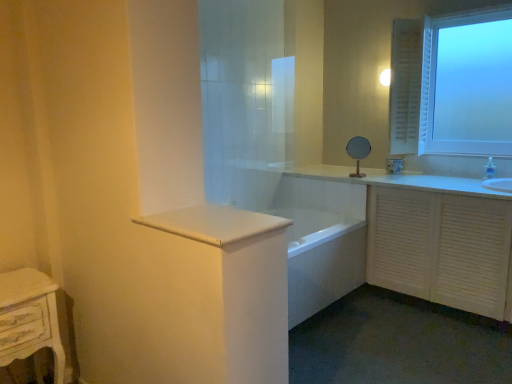
Where is `white glossy countertop at center`? white glossy countertop at center is located at coordinates (214, 223).

The image size is (512, 384). I want to click on frosted glass window at upper right, so click(429, 86).

Is there a large distance between white distressed wood nightstand at lower left and white wooden cabinet at right?

Yes, white distressed wood nightstand at lower left and white wooden cabinet at right are located far from each other.

Who is more distant, white distressed wood nightstand at lower left or white wooden cabinet at right?

white wooden cabinet at right is more distant.

Does point (0, 366) come farther from viewer compared to point (405, 191)?

No.

Is white distressed wood nightstand at lower left facing away from white wooden cabinet at right?

That's not correct — white distressed wood nightstand at lower left is not looking away from white wooden cabinet at right.

Would you say white glossy bathtub at center is to the left or to the right of white wooden cabinet at right in the picture?

white glossy bathtub at center is to the left of white wooden cabinet at right.

Is white glossy bathtub at center far from white wooden cabinet at right?

No, white glossy bathtub at center is not far from white wooden cabinet at right.

Locate an element on the screen. The image size is (512, 384). bath on the left of the white wooden cabinet at right is located at coordinates coord(321,259).

Is frosted glass window at upper right far from white glossy bathtub at center?

Absolutely, frosted glass window at upper right is distant from white glossy bathtub at center.

Looking at this image, in terms of size, does frosted glass window at upper right appear bigger or smaller than white glossy bathtub at center?

In the image, frosted glass window at upper right appears to be smaller than white glossy bathtub at center.

From a real-world perspective, is frosted glass window at upper right on white glossy bathtub at center?

Correct, in the physical world, frosted glass window at upper right is higher than white glossy bathtub at center.

Considering the relative sizes of frosted glass window at upper right and white glossy bathtub at center in the image provided, is frosted glass window at upper right thinner than white glossy bathtub at center?

Yes, frosted glass window at upper right is thinner than white glossy bathtub at center.

Considering the sizes of objects white glossy countertop at center and white wooden cabinet at right in the image provided, who is bigger, white glossy countertop at center or white wooden cabinet at right?

Bigger between the two is white wooden cabinet at right.

Between white glossy countertop at center and white wooden cabinet at right, which one is positioned in front?

white glossy countertop at center is in front.

From a real-world perspective, which object rests below the other?

In real-world perspective, white wooden cabinet at right is lower.

Does point (177, 228) come closer to viewer compared to point (462, 308)?

Yes, point (177, 228) is in front of point (462, 308).

How many degrees apart are the facing directions of white glossy bathtub at center and white distressed wood nightstand at lower left?

0.000189 degrees separate the facing orientations of white glossy bathtub at center and white distressed wood nightstand at lower left.

Based on their sizes in the image, would you say white glossy bathtub at center is bigger or smaller than white distressed wood nightstand at lower left?

white glossy bathtub at center is bigger than white distressed wood nightstand at lower left.

Can white distressed wood nightstand at lower left be found inside white glossy bathtub at center?

That's incorrect, white distressed wood nightstand at lower left is not inside white glossy bathtub at center.

From a real-world perspective, who is located higher, white glossy bathtub at center or white distressed wood nightstand at lower left?

In real-world perspective, white distressed wood nightstand at lower left is above.

Is the surface of white glossy countertop at center in direct contact with frosted glass window at upper right?

No, white glossy countertop at center is not touching frosted glass window at upper right.

Is white glossy countertop at center positioned with its back to frosted glass window at upper right?

white glossy countertop at center is not turned away from frosted glass window at upper right.

Considering the sizes of objects white glossy countertop at center and frosted glass window at upper right in the image provided, who is shorter, white glossy countertop at center or frosted glass window at upper right?

Standing shorter between the two is white glossy countertop at center.

From a real-world perspective, relative to frosted glass window at upper right, is white glossy countertop at center vertically above or below?

white glossy countertop at center is below frosted glass window at upper right.

In the scene shown: Measure the distance between white distressed wood nightstand at lower left and white glossy countertop at center.

They are 82.84 centimeters apart.

Between white distressed wood nightstand at lower left and white glossy countertop at center, which one has smaller size?

Smaller between the two is white glossy countertop at center.

Looking at this image, from a real-world perspective, is white distressed wood nightstand at lower left below white glossy countertop at center?

Yes.

Considering the positions of objects white distressed wood nightstand at lower left and white glossy countertop at center in the image provided, who is more to the left, white distressed wood nightstand at lower left or white glossy countertop at center?

From the viewer's perspective, white distressed wood nightstand at lower left appears more on the left side.

Where is `nightstand on the left of white wooden cabinet at right`? nightstand on the left of white wooden cabinet at right is located at coordinates (30, 318).

Locate an element on the screen. bath located underneath the white wooden cabinet at right (from a real-world perspective) is located at coordinates (321, 259).

From the image, which object appears to be farther from white glossy countertop at center, white glossy bathtub at center or white distressed wood nightstand at lower left?

white glossy bathtub at center lies further to white glossy countertop at center than the other object.

Which object lies further to the anchor point white glossy bathtub at center, frosted glass window at upper right or white glossy countertop at center?

Based on the image, white glossy countertop at center appears to be further to white glossy bathtub at center.

When comparing their distances from white wooden cabinet at right, does frosted glass window at upper right or white glossy bathtub at center seem further?

frosted glass window at upper right is further to white wooden cabinet at right.

From the image, which object appears to be nearer to white wooden cabinet at right, frosted glass window at upper right or white distressed wood nightstand at lower left?

Based on the image, frosted glass window at upper right appears to be nearer to white wooden cabinet at right.

Which object lies further to the anchor point white glossy countertop at center, white glossy bathtub at center or frosted glass window at upper right?

The object further to white glossy countertop at center is frosted glass window at upper right.

Which object lies further to the anchor point white glossy countertop at center, white distressed wood nightstand at lower left or white glossy bathtub at center?

Among the two, white glossy bathtub at center is located further to white glossy countertop at center.

Which object lies nearer to the anchor point white distressed wood nightstand at lower left, white wooden cabinet at right or frosted glass window at upper right?

white wooden cabinet at right lies closer to white distressed wood nightstand at lower left than the other object.

From the image, which object appears to be nearer to frosted glass window at upper right, white glossy countertop at center or white distressed wood nightstand at lower left?

white glossy countertop at center is positioned closer to the anchor frosted glass window at upper right.

Locate an element on the screen. This screenshot has width=512, height=384. counter top between white distressed wood nightstand at lower left and white glossy bathtub at center is located at coordinates (214, 223).

Find the location of `bath located between white distressed wood nightstand at lower left and frosted glass window at upper right in the left-right direction`. bath located between white distressed wood nightstand at lower left and frosted glass window at upper right in the left-right direction is located at coordinates (321, 259).

Where is `counter top between white distressed wood nightstand at lower left and frosted glass window at upper right`? counter top between white distressed wood nightstand at lower left and frosted glass window at upper right is located at coordinates (214, 223).

Identify the location of bath between white glossy countertop at center and frosted glass window at upper right. This screenshot has width=512, height=384. (321, 259).